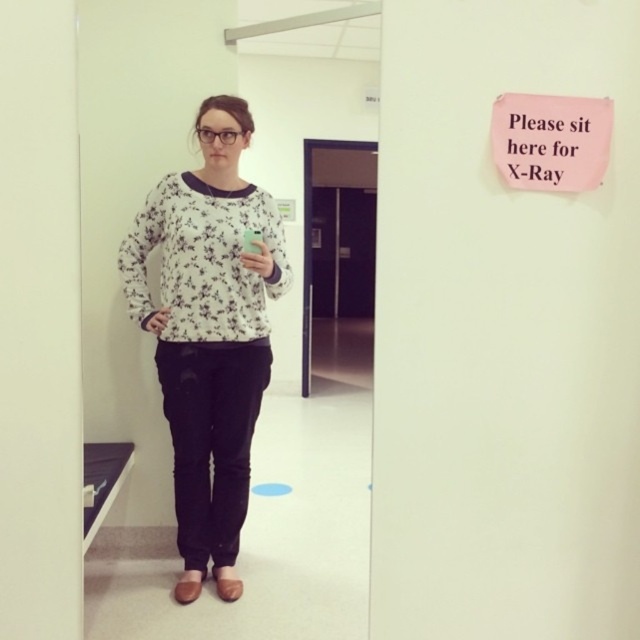
Question: Is white floral sweater at center thinner than pink paper sign at upper right?

Choices:
 (A) no
 (B) yes

Answer: (A)

Question: Which of the following is the closest to the observer?

Choices:
 (A) pink paper sign at upper right
 (B) white floral sweater at center

Answer: (A)

Question: Is the position of white floral sweater at center more distant than that of pink paper sign at upper right?

Choices:
 (A) no
 (B) yes

Answer: (B)

Question: Does white floral sweater at center appear under pink paper sign at upper right?

Choices:
 (A) yes
 (B) no

Answer: (A)

Question: Which object is farther from the camera taking this photo?

Choices:
 (A) white floral sweater at center
 (B) pink paper sign at upper right

Answer: (A)